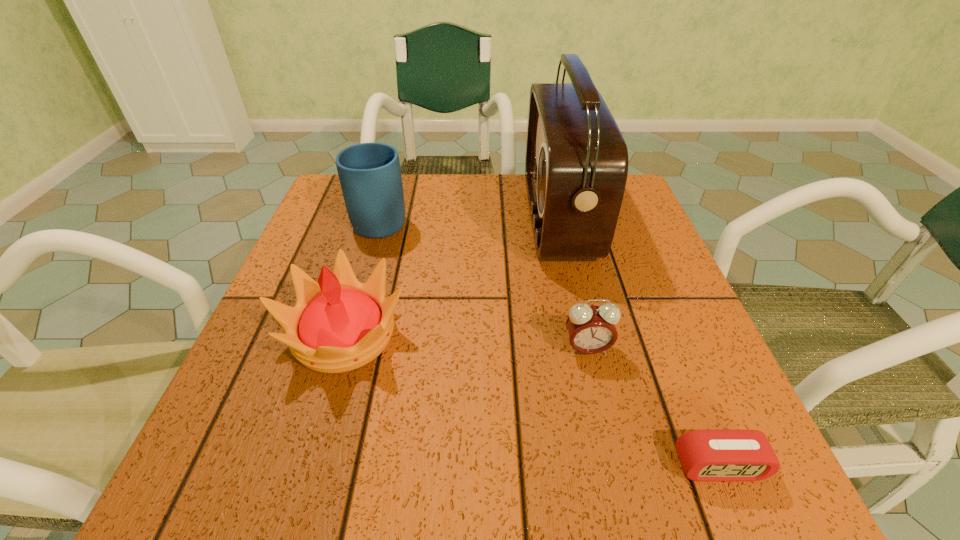
This screenshot has height=540, width=960. I want to click on free region located 0.090m on the side of the mug with the handle, so click(393, 179).

The height and width of the screenshot is (540, 960). I want to click on free space located 0.150m on the back of the crown, so click(372, 242).

Find the location of a particular element. Image resolution: width=960 pixels, height=540 pixels. vacant point located on the clock face of the farther alarm clock is located at coordinates (612, 461).

Locate an element on the screen. The width and height of the screenshot is (960, 540). radio receiver located in the far edge section of the desktop is located at coordinates (576, 164).

Locate an element on the screen. This screenshot has width=960, height=540. mug at the far edge is located at coordinates (370, 177).

Where is `object positioned at the near edge`? The image size is (960, 540). object positioned at the near edge is located at coordinates (706, 455).

The width and height of the screenshot is (960, 540). Identify the location of mug present at the left edge. (370, 177).

Find the location of a particular element. The image size is (960, 540). crown that is at the left edge is located at coordinates (339, 324).

At what (x,y) coordinates should I click in order to perform the action: click on radio receiver at the right edge. Please return your answer as a coordinate pair (x, y). The image size is (960, 540). Looking at the image, I should click on (576, 164).

You are a GUI agent. You are given a task and a screenshot of the screen. Output one action in this format:
    pyautogui.click(x=<x>, y=<y>)
    Task: Click on the alarm clock that is at the right edge
    This screenshot has width=960, height=540.
    Given the screenshot: What is the action you would take?
    click(x=706, y=455)